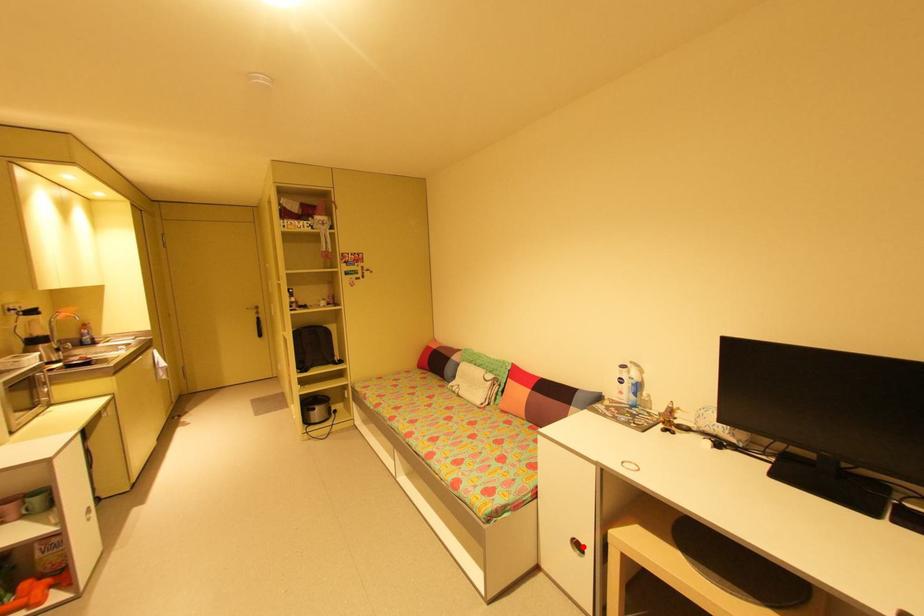
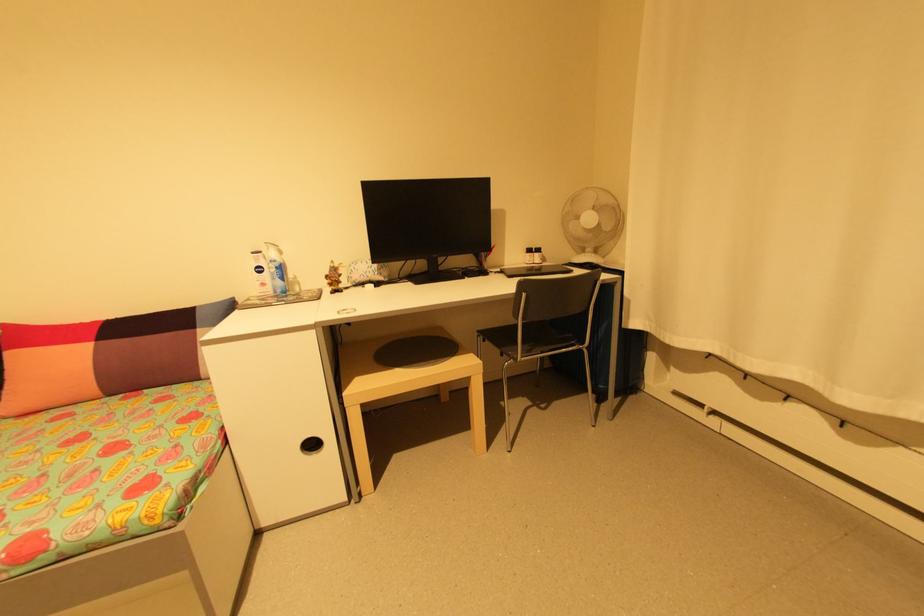
Where in the second image is the point corresponding to the highlighted location from the first image?

(317, 446)